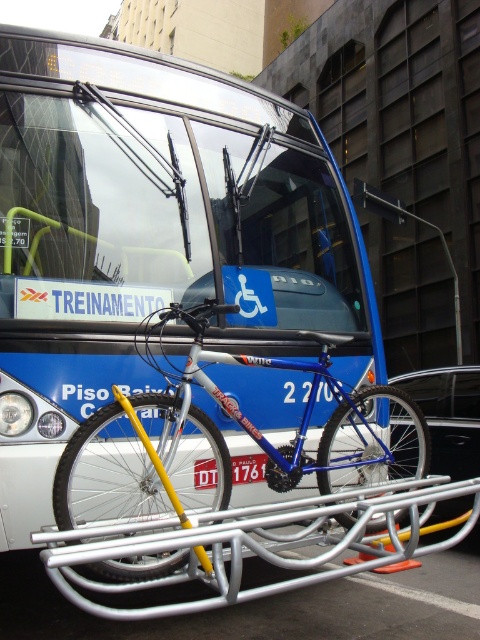
You are a delivery person who needs to attach a small package to the blue matte bus at center and the white plastic license plate at center. Which object can you place the package on if it requires a larger surface area?

The blue matte bus at center is bigger than the white plastic license plate at center, so you can place the package on the blue matte bus at center.

From the picture: You are a pedestrian standing in front of the bus. You see the blue metallic bicycle at center and the white plastic license plate at center. Which object is nearer to you?

The blue metallic bicycle at center is closer to the viewer than the white plastic license plate at center.